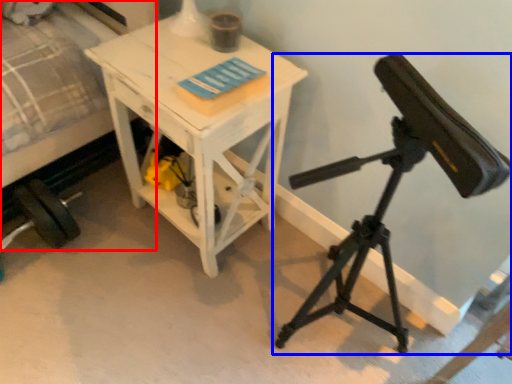
Question: Which of the following is the closest to the observer, bed (highlighted by a red box) or tripod (highlighted by a blue box)?

Choices:
 (A) bed
 (B) tripod

Answer: (B)